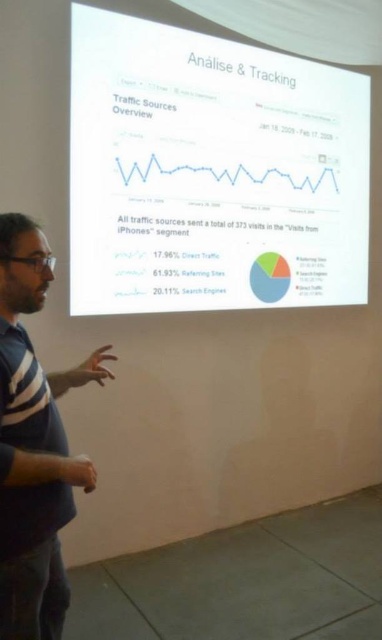
Question: Does white glossy projector screen at upper center have a lesser width compared to striped cotton shirt at left?

Choices:
 (A) yes
 (B) no

Answer: (B)

Question: Which of the following is the closest to the observer?

Choices:
 (A) [123, 68]
 (B) [51, 378]

Answer: (B)

Question: Is white glossy projector screen at upper center to the right of striped cotton shirt at left from the viewer's perspective?

Choices:
 (A) yes
 (B) no

Answer: (A)

Question: Is white glossy projector screen at upper center to the left of striped cotton shirt at left from the viewer's perspective?

Choices:
 (A) yes
 (B) no

Answer: (B)

Question: Which object is closer to the camera taking this photo?

Choices:
 (A) white glossy projector screen at upper center
 (B) striped cotton shirt at left

Answer: (B)